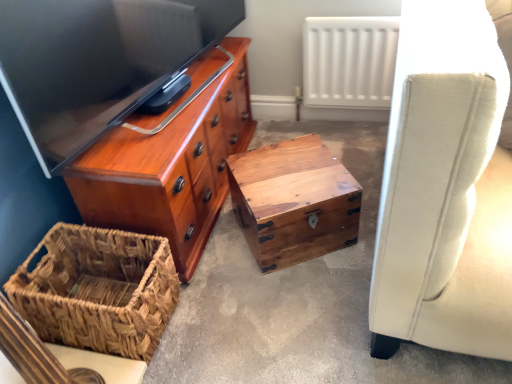
Find the location of a particular element. vacant area that lies to the right of woven brown picnic basket at lower left is located at coordinates (214, 308).